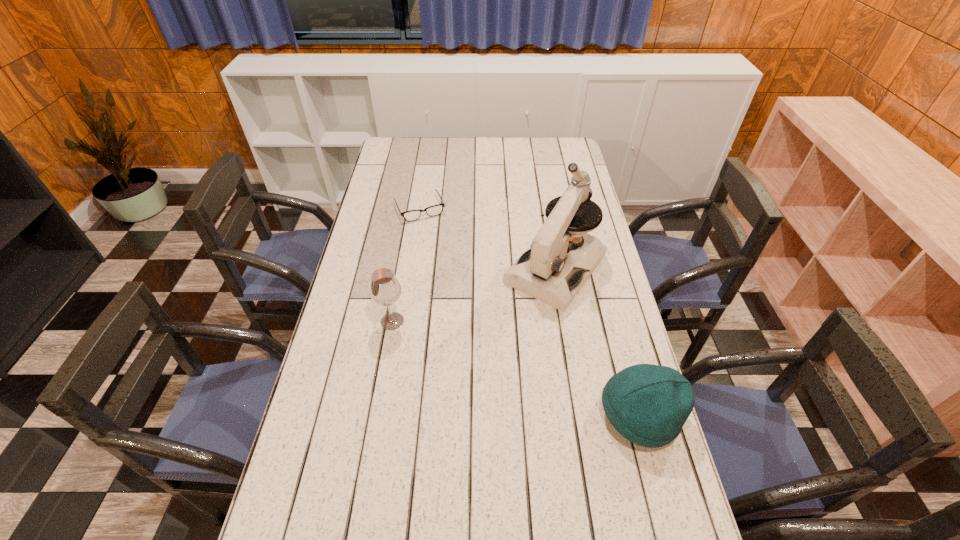
The height and width of the screenshot is (540, 960). Find the location of `free spot located 0.100m at the eyepiece of the tallest object`. free spot located 0.100m at the eyepiece of the tallest object is located at coordinates (513, 325).

Image resolution: width=960 pixels, height=540 pixels. I want to click on vacant space situated 0.370m on the front-facing side of the shortest object, so click(457, 288).

Where is `free space located on the front-facing side of the shortest object`? The height and width of the screenshot is (540, 960). free space located on the front-facing side of the shortest object is located at coordinates (437, 245).

You are a GUI agent. You are given a task and a screenshot of the screen. Output one action in this format:
    pyautogui.click(x=<x>, y=<y>)
    Task: Click on the free space located 0.240m on the front-facing side of the shortest object
    
    Given the screenshot: What is the action you would take?
    pyautogui.click(x=445, y=263)

Where is `wineglass at the left edge`? Image resolution: width=960 pixels, height=540 pixels. wineglass at the left edge is located at coordinates (385, 289).

Identify the location of spectacles at the left edge. This screenshot has height=540, width=960. (412, 215).

The width and height of the screenshot is (960, 540). I want to click on beanie that is at the right edge, so click(647, 404).

Where is `microscope that is positioned at the right edge`? This screenshot has height=540, width=960. microscope that is positioned at the right edge is located at coordinates (549, 270).

The width and height of the screenshot is (960, 540). What are the coordinates of `vacant space at the far edge of the desktop` in the screenshot? It's located at (424, 153).

The image size is (960, 540). Identify the location of vacant region at the near edge of the desktop. (370, 500).